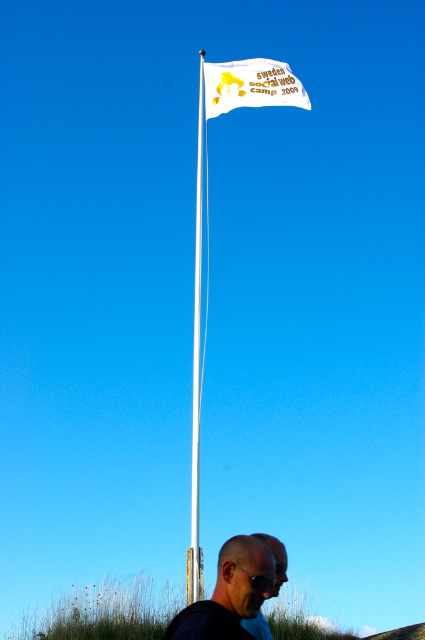
You are a photographer trying to capture the white plastic flag pole at upper center in your shot. There is a dark blue shirt at lower center blocking part of the pole. Which direction should you move your camera to frame the pole without the shirt blocking it?

The dark blue shirt at lower center is on the right side of the white plastic flag pole at upper center. To avoid the shirt blocking the pole, move your camera to the left so the pole remains centered while the shirt moves out of frame.

You are taking a photo of the flagpole and want to focus on both point (70, 625) and point (283, 552). Which point is closer to your camera lens?

Point (70, 625) is further to the camera than point (283, 552), so the point closer to the camera lens is point (283, 552).

You are standing at the flagpole and want to walk towards the point labeled as point (x=223, y=568). Which direction should you go relative to the point labeled as point (x=193, y=356)?

Since point (x=223, y=568) is in front of point (x=193, y=356), you should walk towards the direction of point (x=223, y=568) which is ahead of point (x=193, y=356).